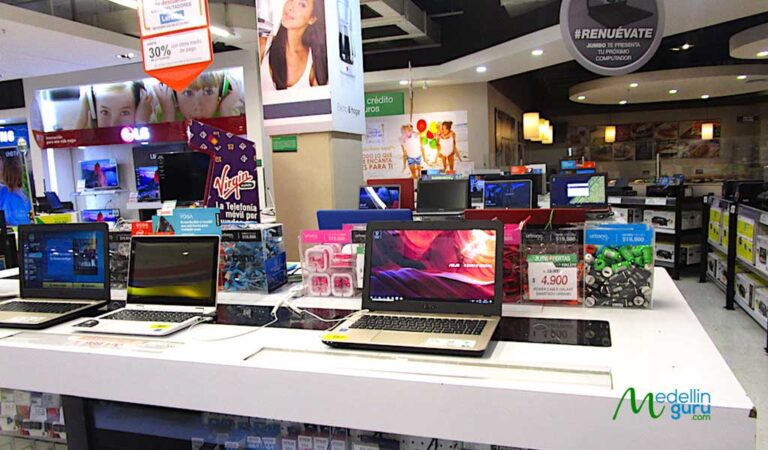
What are the coordinates of `laptop` in the screenshot? It's located at (x=512, y=198).